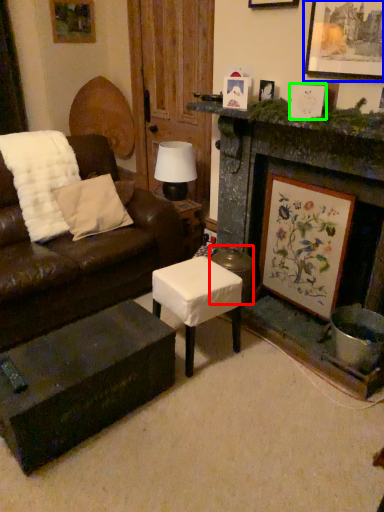
Question: Which object is the closest to the stool (highlighted by a red box)? Choose among these: picture frame (highlighted by a blue box) or picture frame (highlighted by a green box).

Choices:
 (A) picture frame
 (B) picture frame

Answer: (B)